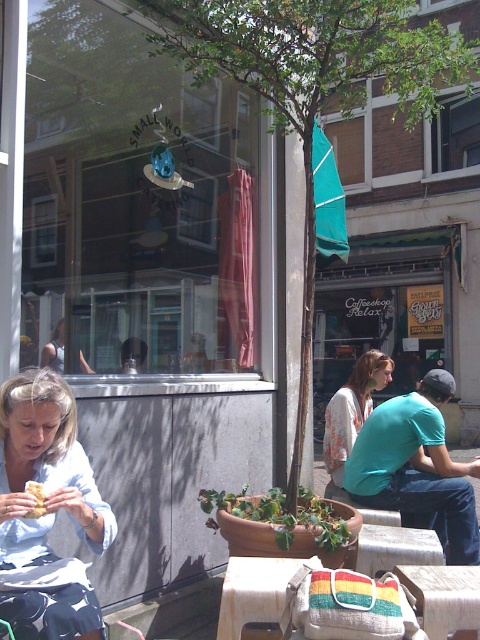
Question: Is wooden table at center smaller than wooden textured table at center?

Choices:
 (A) yes
 (B) no

Answer: (B)

Question: Which object is the closest to the white floral blouse at center?

Choices:
 (A) wooden picnic table at center
 (B) wooden textured table at center
 (C) light blue cotton shirt at lower left
 (D) wooden table at center

Answer: (B)

Question: Can you confirm if wooden table at center is bigger than wooden picnic table at center?

Choices:
 (A) yes
 (B) no

Answer: (A)

Question: Which object is closer to the camera taking this photo?

Choices:
 (A) wooden table at center
 (B) wooden textured table at center
 (C) light blue cotton shirt at lower left

Answer: (C)

Question: Which point is farther to the camera?

Choices:
 (A) wooden table at center
 (B) white floral blouse at center
 (C) light blue cotton shirt at lower left

Answer: (B)

Question: From the image, what is the correct spatial relationship of wooden table at center in relation to wooden picnic table at center?

Choices:
 (A) below
 (B) above

Answer: (B)